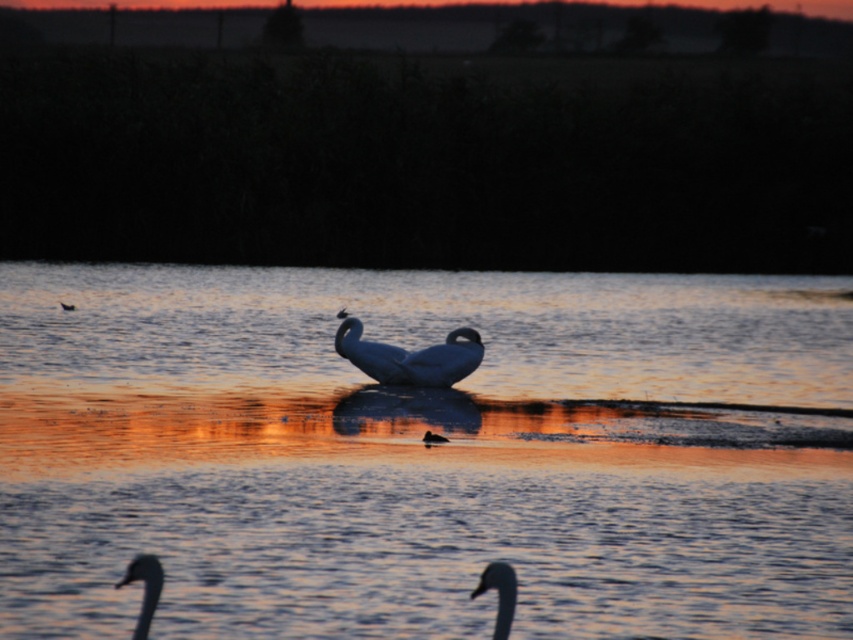
Measure the distance from white glossy swan at center to brown fuzzy duck at center.

They are 3.49 meters apart.

Which of these two, white glossy swan at center or brown fuzzy duck at center, stands shorter?

brown fuzzy duck at center

Is point (434, 380) positioned in front of point (432, 433)?

No, it is behind (432, 433).

At what (x,y) coordinates should I click in order to perform the action: click on white glossy swan at center. Please return your answer as a coordinate pair (x, y). The width and height of the screenshot is (853, 640). Looking at the image, I should click on (409, 356).

Can you confirm if glistening water at center is taller than white glossy swan at lower left?

Yes.

Which of these two, glistening water at center or white glossy swan at lower left, stands taller?

Standing taller between the two is glistening water at center.

This screenshot has height=640, width=853. What do you see at coordinates (421, 452) in the screenshot? I see `glistening water at center` at bounding box center [421, 452].

Image resolution: width=853 pixels, height=640 pixels. Find the location of `glistening water at center`. glistening water at center is located at coordinates (421, 452).

Which is more to the right, glistening water at center or brown fuzzy duck at center?

brown fuzzy duck at center

Based on the photo, can you confirm if glistening water at center is bigger than brown fuzzy duck at center?

Correct, glistening water at center is larger in size than brown fuzzy duck at center.

Does point (260, 620) come in front of point (439, 442)?

Yes, it is in front of point (439, 442).

Find the location of `glistening water at center`. glistening water at center is located at coordinates (421, 452).